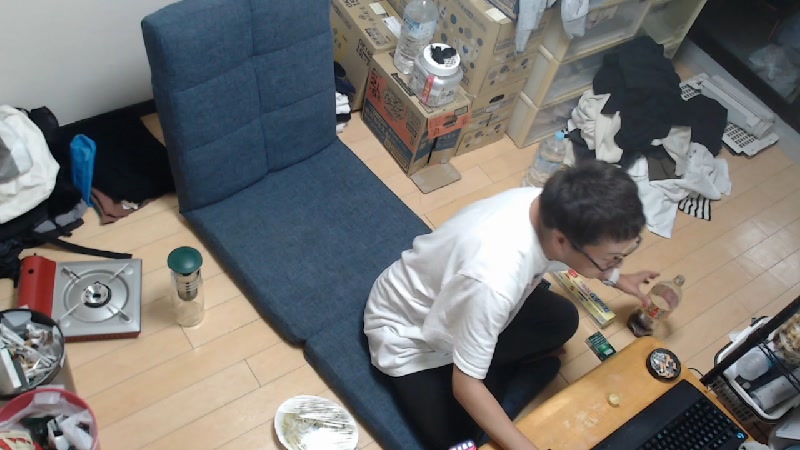
The image size is (800, 450). Find the location of `glass bottle`. glass bottle is located at coordinates (666, 294).